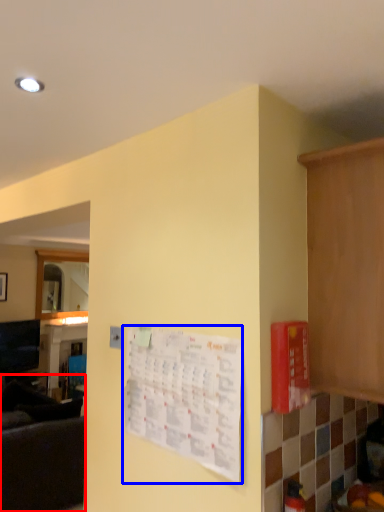
Question: Which object is further to the camera taking this photo, couch (highlighted by a red box) or bulletin board (highlighted by a blue box)?

Choices:
 (A) couch
 (B) bulletin board

Answer: (A)